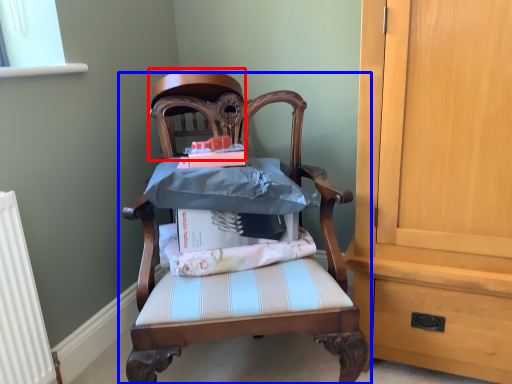
Question: Among these objects, which one is nearest to the camera, chair (highlighted by a red box) or chair (highlighted by a blue box)?

Choices:
 (A) chair
 (B) chair

Answer: (B)